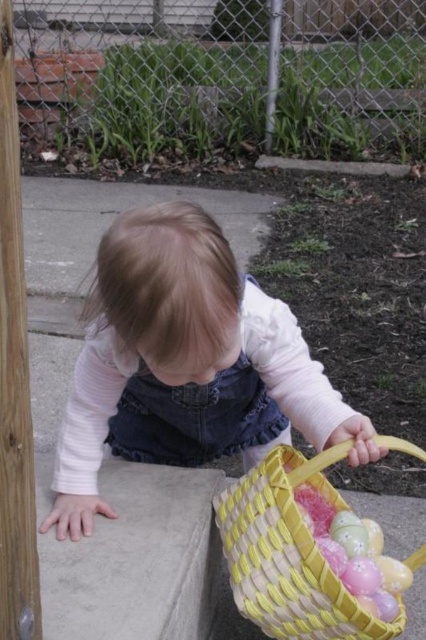
Question: Which point is farther to the camera?

Choices:
 (A) pastel plastic eggs at lower center
 (B) yellow woven basket at lower right
 (C) pink denim overalls at center

Answer: (A)

Question: Is pink denim overalls at center wider than yellow woven basket at lower right?

Choices:
 (A) yes
 (B) no

Answer: (A)

Question: Is pink denim overalls at center bigger than pastel plastic eggs at lower center?

Choices:
 (A) yes
 (B) no

Answer: (A)

Question: Can you confirm if pink denim overalls at center is thinner than yellow woven basket at lower right?

Choices:
 (A) no
 (B) yes

Answer: (A)

Question: Which of these objects is positioned farthest from the pink denim overalls at center?

Choices:
 (A) pastel plastic eggs at lower center
 (B) yellow woven basket at lower right

Answer: (A)

Question: Which is farther from the pastel plastic eggs at lower center?

Choices:
 (A) yellow woven basket at lower right
 (B) pink denim overalls at center

Answer: (B)